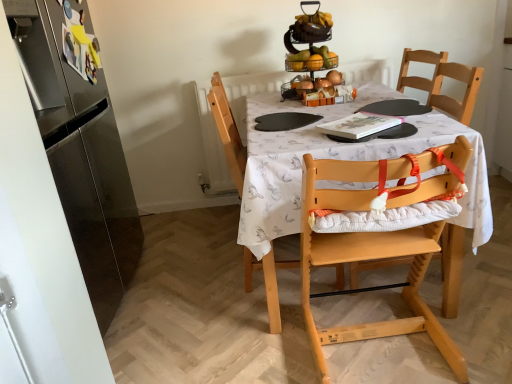
The width and height of the screenshot is (512, 384). Identify the location of free region on the left part of light wood highchair at center, the first chair in the front-to-back sequence. (256, 343).